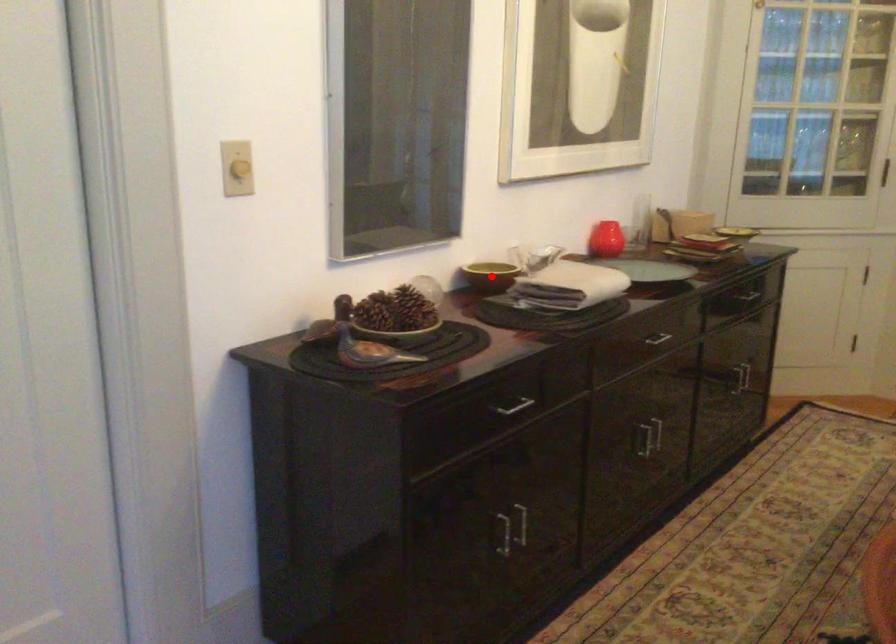
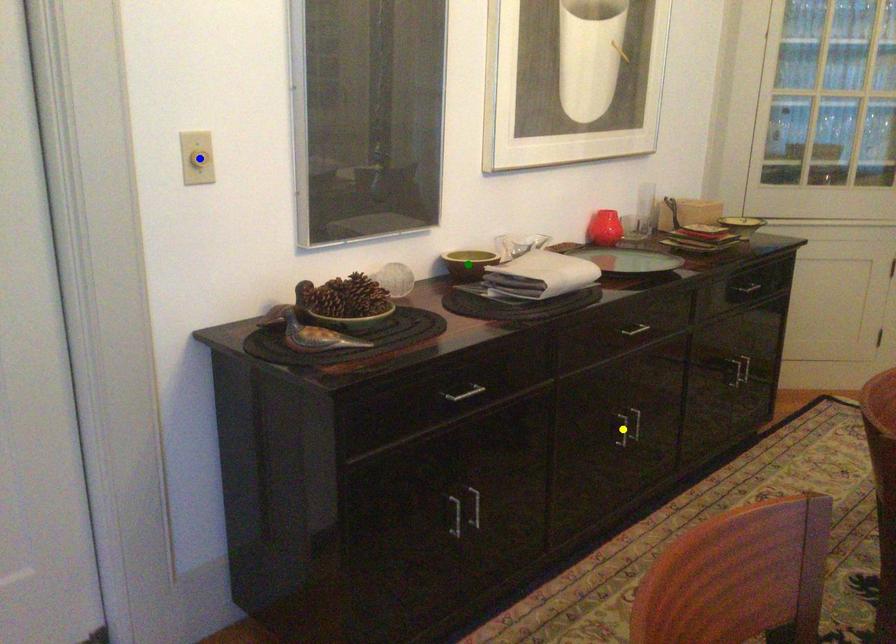
Question: I am providing you with two images of the same scene from different viewpoints. A red point is marked on the first image. You are given multiple points on the second image. Can you choose the point in image 2 that corresponds to the point in image 1?

Choices:
 (A) green point
 (B) yellow point
 (C) blue point

Answer: (A)